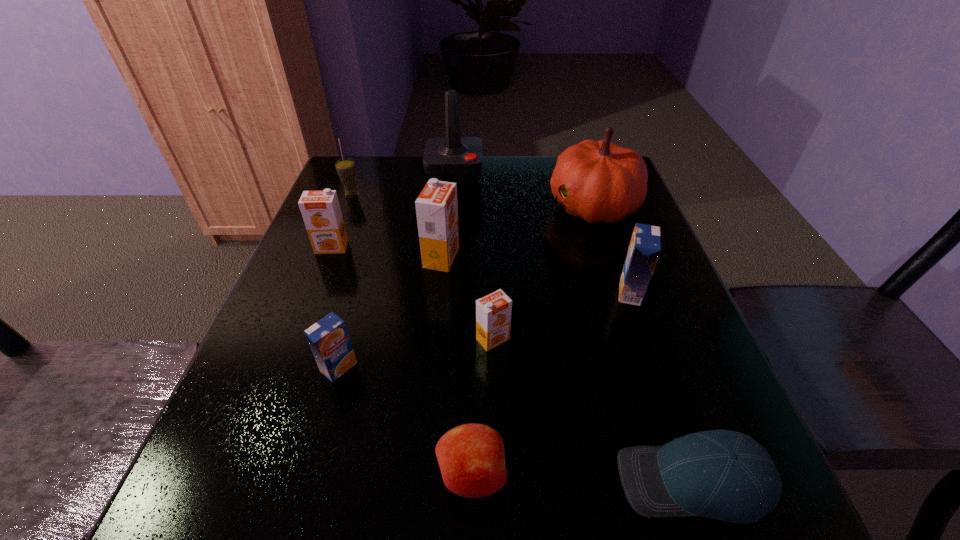
The width and height of the screenshot is (960, 540). I want to click on joystick, so click(456, 159).

Identify the location of pink pumpkin. Image resolution: width=960 pixels, height=540 pixels. (599, 181).

This screenshot has width=960, height=540. Find the location of `the eighth shortest object`. the eighth shortest object is located at coordinates (436, 207).

This screenshot has width=960, height=540. Find the location of `the tallest orange juice`. the tallest orange juice is located at coordinates 436,207.

Find the location of a particular element. yellow straw for drinking is located at coordinates (345, 167).

This screenshot has height=540, width=960. I want to click on the rightmost orange juice, so click(645, 246).

Find the location of `the bigger blue orange_juice`. the bigger blue orange_juice is located at coordinates (645, 246).

This screenshot has width=960, height=540. What are the coordinates of `the second biggest orange orange juice` in the screenshot? It's located at pos(321,212).

You are a GUI agent. You are given a task and a screenshot of the screen. Output one action in this format:
    pyautogui.click(x=<x>, y=<y>)
    Task: Click on the leftmost orange juice
    
    Given the screenshot: What is the action you would take?
    pyautogui.click(x=321, y=212)

I want to click on the smaller blue orange_juice, so click(x=329, y=340).